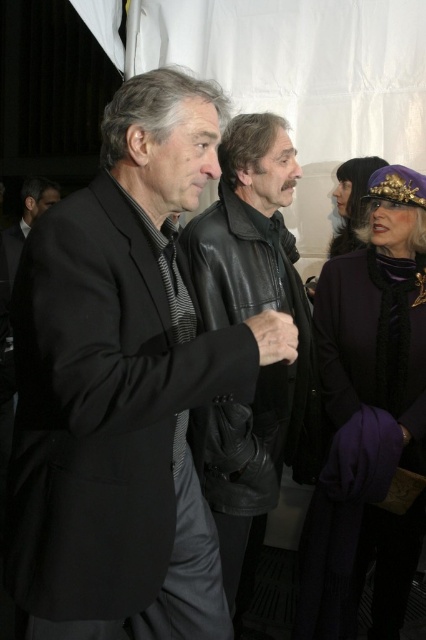
Question: Can you confirm if purple wool coat at upper right is positioned above shiny purple hat at upper right?

Choices:
 (A) no
 (B) yes

Answer: (A)

Question: Which object is closer to the camera taking this photo?

Choices:
 (A) black leather jacket at center
 (B) black matte suit at center

Answer: (B)

Question: Which point is farther to the camera?

Choices:
 (A) black matte suit at center
 (B) purple wool coat at upper right
 (C) black leather jacket at center

Answer: (B)

Question: Estimate the real-world distances between objects in this image. Which object is closer to the black matte suit at center?

Choices:
 (A) purple wool coat at upper right
 (B) shiny purple hat at upper right

Answer: (A)

Question: Is black leather jacket at center positioned behind shiny purple hat at upper right?

Choices:
 (A) yes
 (B) no

Answer: (B)

Question: Can you confirm if purple wool coat at upper right is smaller than shiny purple hat at upper right?

Choices:
 (A) yes
 (B) no

Answer: (B)